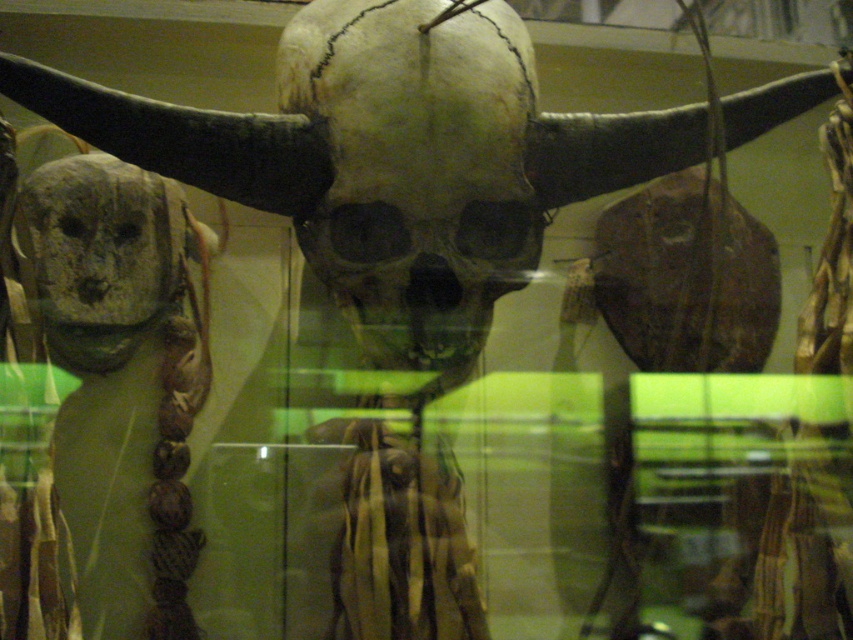
Question: Can you confirm if matte white skull at center is positioned to the right of gray stone skull at left?

Choices:
 (A) no
 (B) yes

Answer: (B)

Question: Considering the relative positions of matte white skull at center and gray stone skull at left in the image provided, where is matte white skull at center located with respect to gray stone skull at left?

Choices:
 (A) above
 (B) below

Answer: (A)

Question: Which point is closer to the camera taking this photo?

Choices:
 (A) (395, 321)
 (B) (59, 243)

Answer: (A)

Question: Is matte white skull at center positioned at the back of gray stone skull at left?

Choices:
 (A) no
 (B) yes

Answer: (A)